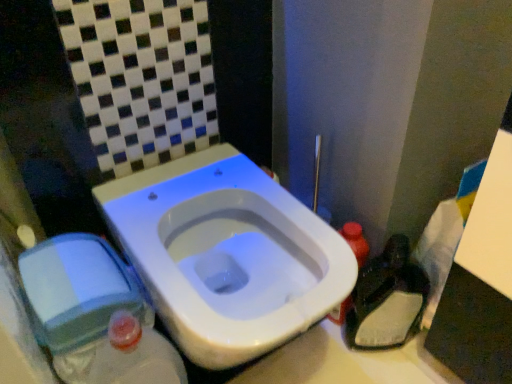
Question: Is white glossy toilet at center looking in the opposite direction of dark plastic bag at lower right?

Choices:
 (A) no
 (B) yes

Answer: (A)

Question: Is white glossy toilet at center positioned in front of dark plastic bag at lower right?

Choices:
 (A) no
 (B) yes

Answer: (B)

Question: Considering the relative positions of white glossy toilet at center and dark plastic bag at lower right in the image provided, is white glossy toilet at center behind dark plastic bag at lower right?

Choices:
 (A) yes
 (B) no

Answer: (B)

Question: From the image's perspective, does white glossy toilet at center appear higher than dark plastic bag at lower right?

Choices:
 (A) no
 (B) yes

Answer: (B)

Question: Does white glossy toilet at center appear on the right side of dark plastic bag at lower right?

Choices:
 (A) no
 (B) yes

Answer: (A)

Question: From a real-world perspective, is white glossy toilet at center located higher than dark plastic bag at lower right?

Choices:
 (A) no
 (B) yes

Answer: (B)

Question: Does translucent plastic bottle at right come in front of dark plastic bag at lower right?

Choices:
 (A) no
 (B) yes

Answer: (A)

Question: Is translucent plastic bottle at right completely or partially outside of dark plastic bag at lower right?

Choices:
 (A) yes
 (B) no

Answer: (A)

Question: From the image's perspective, is translucent plastic bottle at right below dark plastic bag at lower right?

Choices:
 (A) no
 (B) yes

Answer: (A)

Question: Is translucent plastic bottle at right next to dark plastic bag at lower right?

Choices:
 (A) no
 (B) yes

Answer: (B)

Question: Is the position of translucent plastic bottle at right more distant than that of dark plastic bag at lower right?

Choices:
 (A) no
 (B) yes

Answer: (B)

Question: Considering the relative sizes of translucent plastic bottle at right and dark plastic bag at lower right in the image provided, is translucent plastic bottle at right thinner than dark plastic bag at lower right?

Choices:
 (A) yes
 (B) no

Answer: (B)

Question: Does dark plastic bag at lower right lie in front of translucent plastic bottle at right?

Choices:
 (A) no
 (B) yes

Answer: (B)